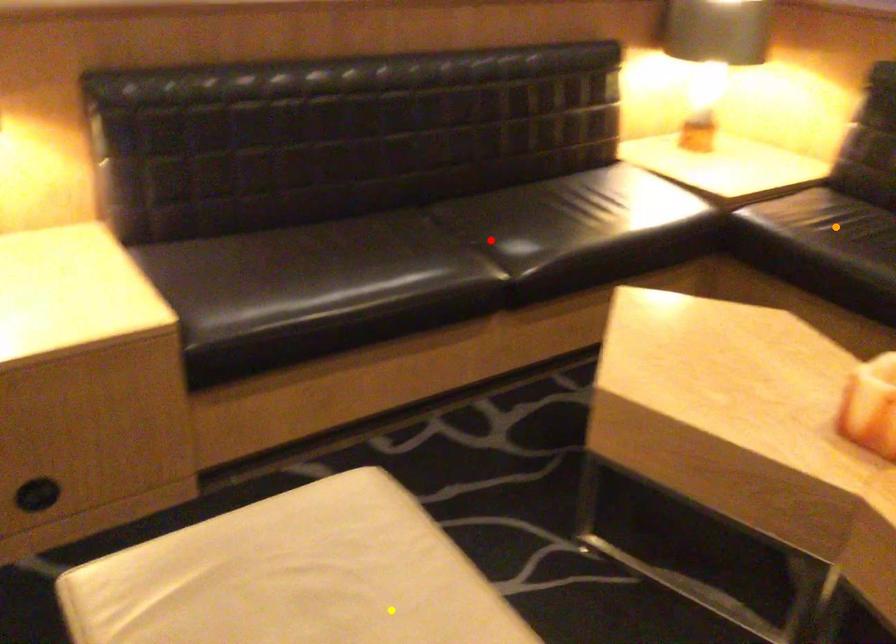
Order these from nearest to farthest:
- red point
- yellow point
- orange point

yellow point < orange point < red point